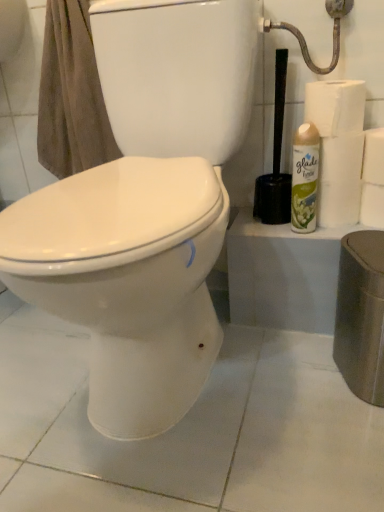
Question: Considering the relative sizes of brown cotton towel at upper left and white paper towel at right, the 3th toilet paper in the top-to-bottom sequence, in the image provided, is brown cotton towel at upper left wider than white paper towel at right, the 3th toilet paper in the top-to-bottom sequence,?

Choices:
 (A) yes
 (B) no

Answer: (A)

Question: Does brown cotton towel at upper left lie behind white paper towel at right, marked as the 2th toilet paper in a bottom-to-top arrangement?

Choices:
 (A) no
 (B) yes

Answer: (A)

Question: Is there a large distance between brown cotton towel at upper left and white paper towel at right, the 3th toilet paper in the top-to-bottom sequence?

Choices:
 (A) no
 (B) yes

Answer: (A)

Question: Is brown cotton towel at upper left next to white paper towel at right, marked as the 2th toilet paper in a bottom-to-top arrangement, and touching it?

Choices:
 (A) no
 (B) yes

Answer: (A)

Question: Is brown cotton towel at upper left to the left of white paper towel at right, the 3th toilet paper in the top-to-bottom sequence, from the viewer's perspective?

Choices:
 (A) no
 (B) yes

Answer: (B)

Question: Is brown cotton towel at upper left taller than white paper towel at right, the 3th toilet paper in the top-to-bottom sequence?

Choices:
 (A) no
 (B) yes

Answer: (B)

Question: Does metallic silver showerhead at upper right have a lesser height compared to white paper towel at upper right, which ranks as the 1th toilet paper in top-to-bottom order?

Choices:
 (A) yes
 (B) no

Answer: (B)

Question: Can you confirm if metallic silver showerhead at upper right is smaller than white paper towel at upper right, arranged as the 4th toilet paper when ordered from the bottom?

Choices:
 (A) yes
 (B) no

Answer: (B)

Question: Are metallic silver showerhead at upper right and white paper towel at upper right, arranged as the 4th toilet paper when ordered from the bottom, beside each other?

Choices:
 (A) yes
 (B) no

Answer: (B)

Question: Is metallic silver showerhead at upper right facing away from white paper towel at upper right, arranged as the 4th toilet paper when ordered from the bottom?

Choices:
 (A) yes
 (B) no

Answer: (B)

Question: From the image's perspective, does metallic silver showerhead at upper right appear lower than white paper towel at upper right, which ranks as the 1th toilet paper in top-to-bottom order?

Choices:
 (A) yes
 (B) no

Answer: (B)

Question: From a real-world perspective, is metallic silver showerhead at upper right over white paper towel at upper right, arranged as the 4th toilet paper when ordered from the bottom?

Choices:
 (A) yes
 (B) no

Answer: (A)

Question: Is white paper at right, placed as the 4th toilet paper when sorted from top to bottom, far away from white paper towel at right, marked as the 2th toilet paper in a bottom-to-top arrangement?

Choices:
 (A) yes
 (B) no

Answer: (B)